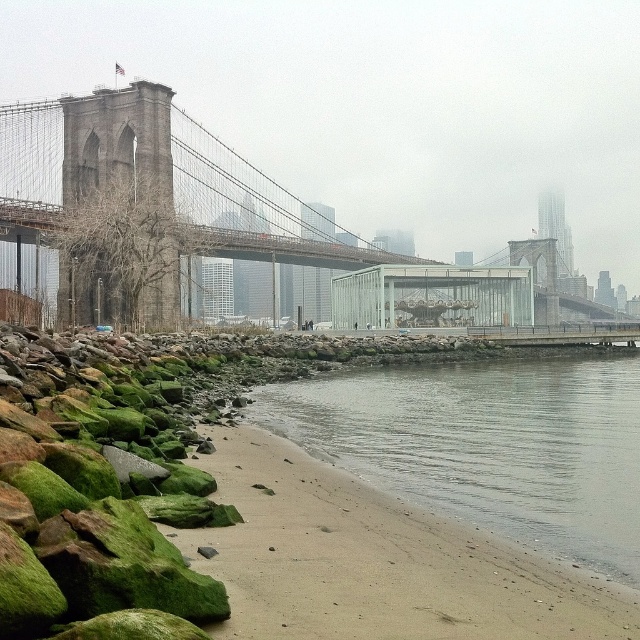
How much distance is there between gray smooth water at lower center and brown stone suspension bridge at center?

The distance of gray smooth water at lower center from brown stone suspension bridge at center is 172.69 feet.

Between gray smooth water at lower center and brown stone suspension bridge at center, which one has more height?

brown stone suspension bridge at center is taller.

Find the location of a particular element. The width and height of the screenshot is (640, 640). gray smooth water at lower center is located at coordinates (488, 444).